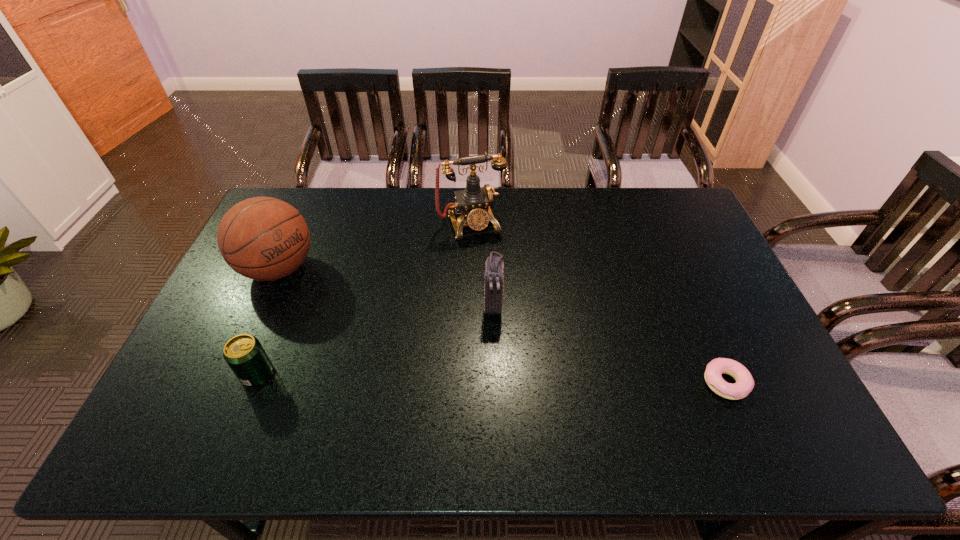
Identify the location of vacant space at the far right corner. (676, 201).

Locate an element on the screen. The image size is (960, 540). empty space that is in between the second shortest object and the telephone is located at coordinates (365, 299).

This screenshot has width=960, height=540. I want to click on vacant area that lies between the basketball and the shortest object, so click(502, 326).

Find the location of a particular element. empty space that is in between the shortest object and the clutch bag is located at coordinates (609, 344).

Where is `free spot between the telephone and the basketball`? This screenshot has width=960, height=540. free spot between the telephone and the basketball is located at coordinates (375, 246).

Identify the location of vacant area that lies between the telephone and the shortest object. Image resolution: width=960 pixels, height=540 pixels. (598, 303).

At what (x,y) coordinates should I click in order to perform the action: click on free space between the telephone and the basketball. Please return your answer as a coordinate pair (x, y). Image resolution: width=960 pixels, height=540 pixels. Looking at the image, I should click on (375, 246).

Image resolution: width=960 pixels, height=540 pixels. In order to click on blank region between the telephone and the third tallest object in this screenshot , I will do `click(482, 265)`.

The image size is (960, 540). Identify the location of vacant area between the basketball and the telephone. (375, 246).

I want to click on free space between the basketball and the beer can, so click(x=268, y=321).